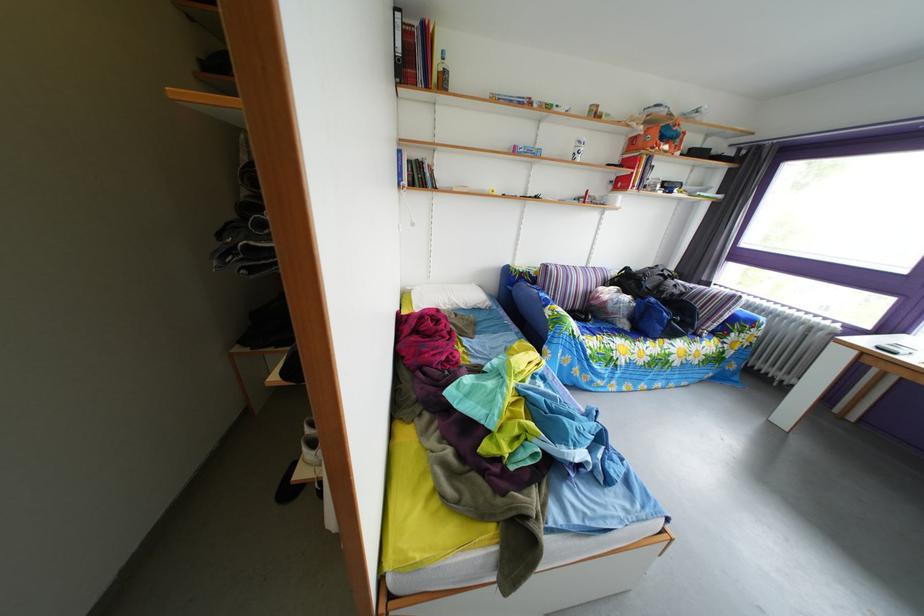
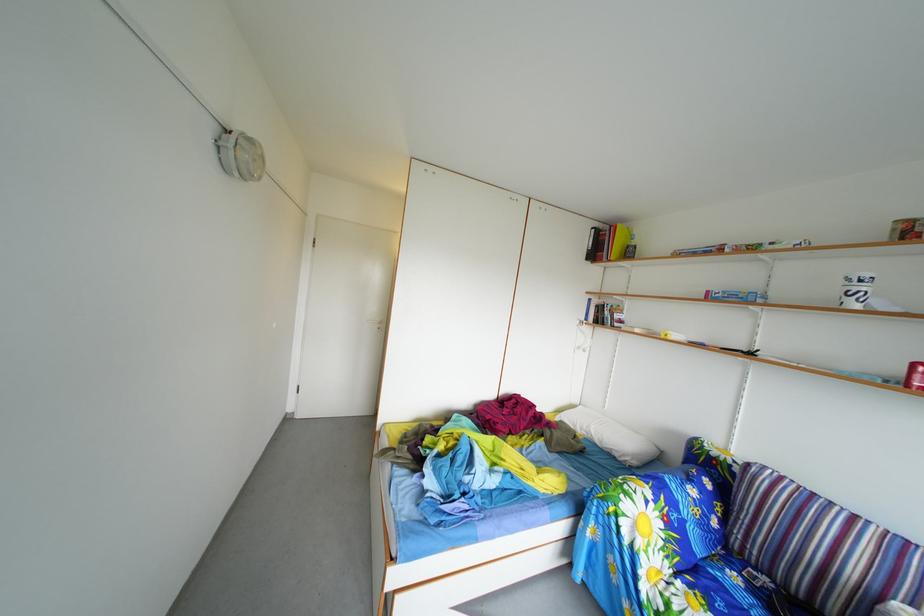
Where in the second image is the point corresponding to the point at 590,150 from the first image?

(859, 288)